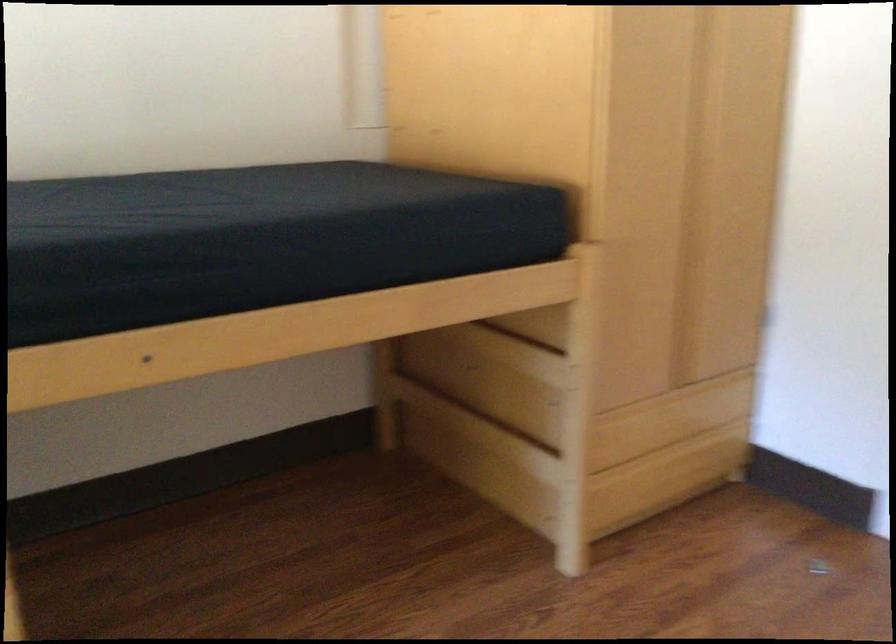
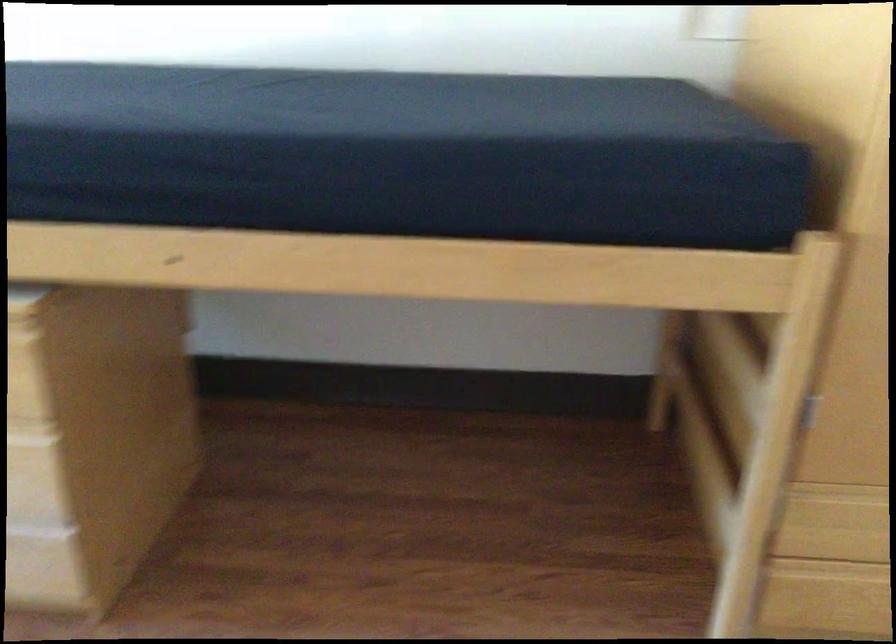
Locate, in the second image, the point that corresponds to (x=403, y=426) in the first image.

(673, 408)